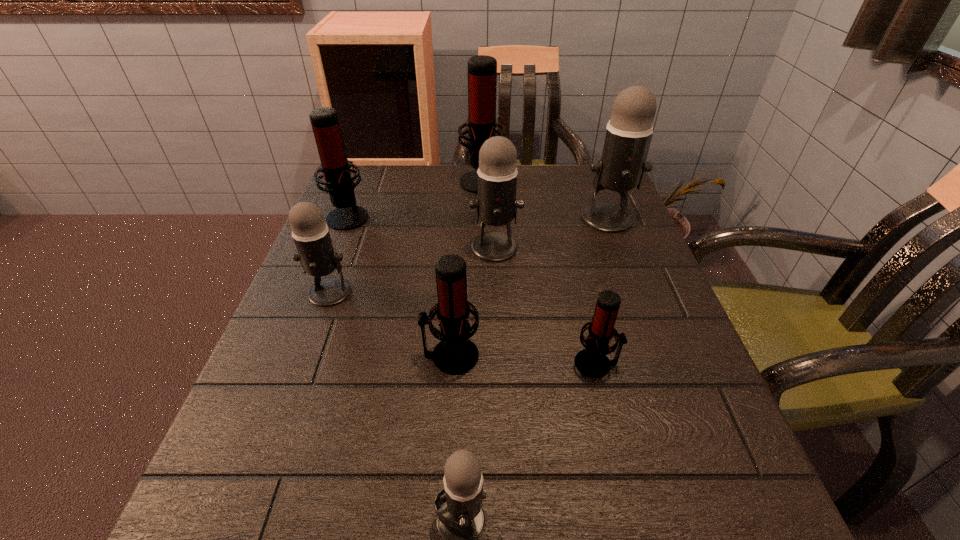
Where is `object that is positioned at the far right corner`? This screenshot has width=960, height=540. object that is positioned at the far right corner is located at coordinates (622, 165).

The image size is (960, 540). I want to click on vacant space at the far edge, so click(x=459, y=168).

The width and height of the screenshot is (960, 540). In order to click on vacant space at the near edge of the desktop in this screenshot , I will do `click(395, 517)`.

Where is `blank space at the left edge`? Image resolution: width=960 pixels, height=540 pixels. blank space at the left edge is located at coordinates (380, 222).

Image resolution: width=960 pixels, height=540 pixels. Identify the location of blank space at the right edge. (711, 418).

At what (x,y) coordinates should I click in order to perform the action: click on vacant area at the far left corner of the desktop. Please return your answer as a coordinate pair (x, y). Looking at the image, I should click on (385, 173).

Identify the location of vacant space at the far right corner. (582, 182).

In the image, there is a desktop. At what (x,y) coordinates should I click in order to perform the action: click on vacant space at the near right corner. Please return your answer as a coordinate pair (x, y). Looking at the image, I should click on (689, 527).

At what (x,y) coordinates should I click in order to perform the action: click on vacant area that lies between the farthest object and the leftmost gray microphone. Please return your answer as a coordinate pair (x, y). The height and width of the screenshot is (540, 960). Looking at the image, I should click on (406, 236).

The image size is (960, 540). I want to click on free space between the third biggest gray microphone and the second biggest gray microphone, so click(x=413, y=269).